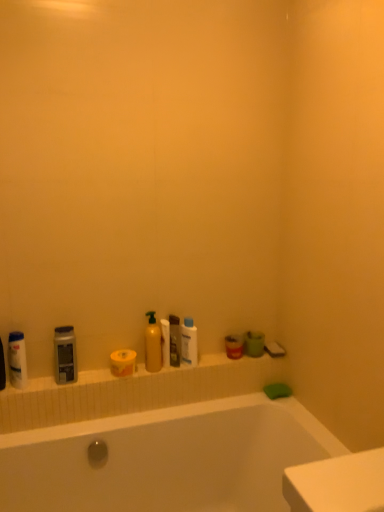
Locate an element on the screen. The height and width of the screenshot is (512, 384). vacant area located to the right-hand side of matte gray bottle at left, which ranks as the third cleaning product in right-to-left order is located at coordinates (94, 378).